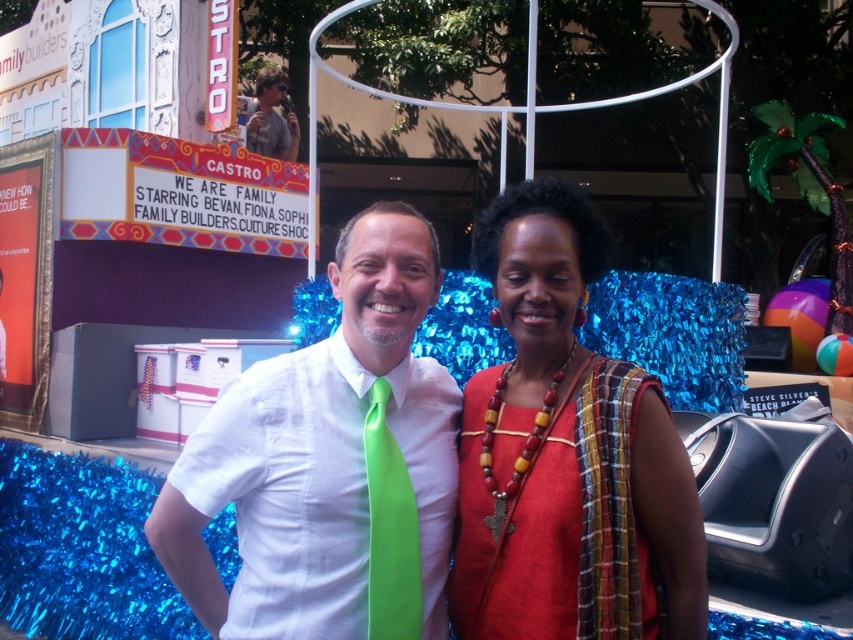
Looking at this image, you are a photographer adjusting your camera to focus on the green satin tie at center and the matte green tie at center. Which tie should you focus on first to ensure it appears sharp in the photo?

You should focus on the green satin tie at center first because it is closer to the viewer than the matte green tie at center.

You are a photographer trying to adjust the lighting for a group photo. You notice the red fabric dress at center and the matte white shirt with green tie at center. Which clothing item should you focus on to ensure it doesn not get overshadowed by the other due to their sizes?

The red fabric dress at center is thinner than the matte white shirt with green tie at center, so you should focus on the red fabric dress at center to ensure it doesn not get overshadowed by the larger matte white shirt with green tie at center.

You are a photographer trying to adjust the lighting for a photo shoot. You have two light sources placed at the coordinates point [390,586] and point [260,140]. Which light source is closer to the camera based on their positions?

Point [390,586] is in front of point [260,140], so the light source at point [390,586] is closer to the camera.